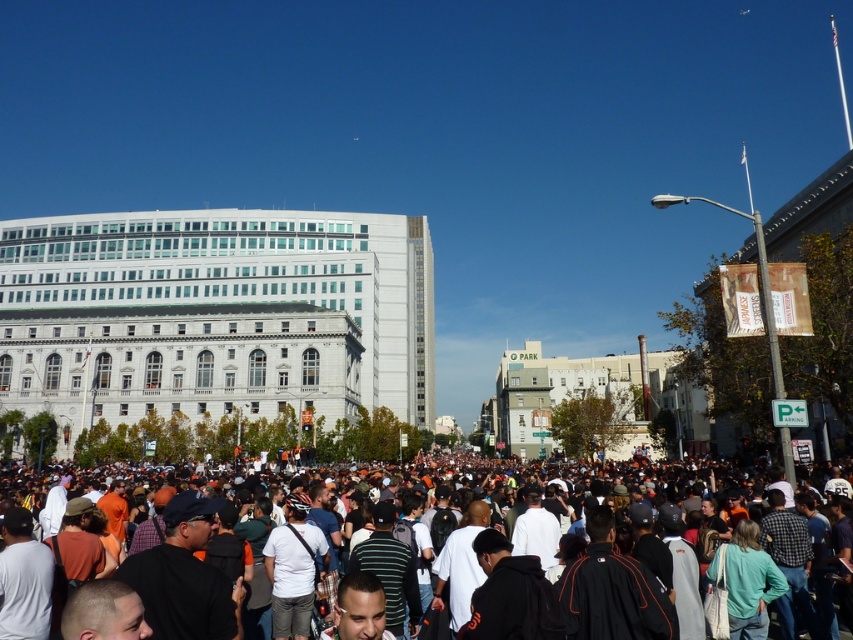
Question: Among these objects, which one is farthest from the camera?

Choices:
 (A) white marble building at center
 (B) orange fabric crowd at center

Answer: (A)

Question: Is white marble building at center in front of orange fabric crowd at center?

Choices:
 (A) no
 (B) yes

Answer: (A)

Question: Which object appears closest to the camera in this image?

Choices:
 (A) white marble building at center
 (B) orange fabric crowd at center

Answer: (B)

Question: Is white marble building at center positioned at the back of orange fabric crowd at center?

Choices:
 (A) yes
 (B) no

Answer: (A)

Question: Where is white marble building at center located in relation to orange fabric crowd at center in the image?

Choices:
 (A) right
 (B) left

Answer: (B)